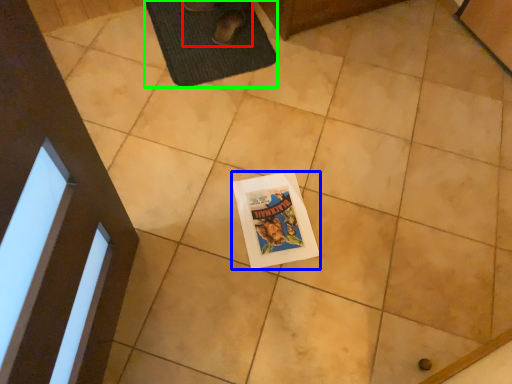
Question: Considering the real-world distances, which object is farthest from person (highlighted by a red box)? comic book (highlighted by a blue box) or bath mat (highlighted by a green box)?

Choices:
 (A) comic book
 (B) bath mat

Answer: (A)